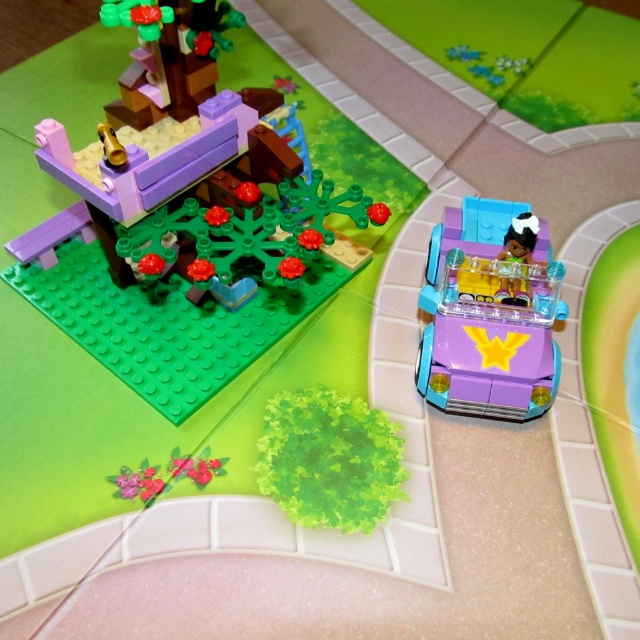
Question: Which point is farther to the camera?

Choices:
 (A) (476, 413)
 (B) (353, 212)

Answer: (B)

Question: Can you confirm if purple glossy car at upper right is bigger than purple plastic car at right?

Choices:
 (A) no
 (B) yes

Answer: (B)

Question: Which point is closer to the camera taking this photo?

Choices:
 (A) (470, 365)
 (B) (177, 374)

Answer: (A)

Question: Which point is farther from the camera taking this photo?

Choices:
 (A) (150, 355)
 (B) (474, 275)

Answer: (A)

Question: Is purple glossy car at upper right further to the viewer compared to purple plastic car at right?

Choices:
 (A) yes
 (B) no

Answer: (B)

Question: Is purple glossy car at upper right smaller than purple plastic car at right?

Choices:
 (A) yes
 (B) no

Answer: (B)